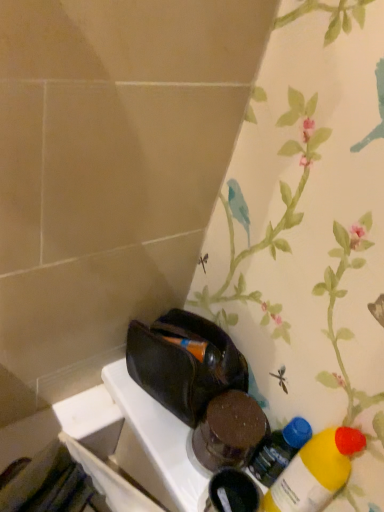
Question: Considering the positions of yellow matte bottle at lower right, the 1th bottle from the front, and translucent plastic bottle at lower right, marked as the 1th bottle in a back-to-front arrangement, in the image, is yellow matte bottle at lower right, the 1th bottle from the front, bigger or smaller than translucent plastic bottle at lower right, marked as the 1th bottle in a back-to-front arrangement,?

Choices:
 (A) small
 (B) big

Answer: (B)

Question: Looking at their shapes, would you say yellow matte bottle at lower right, the 1th bottle from the front, is wider or thinner than translucent plastic bottle at lower right, marked as the 1th bottle in a back-to-front arrangement?

Choices:
 (A) wide
 (B) thin

Answer: (A)

Question: Is point click(x=309, y=473) closer or farther from the camera than point click(x=291, y=435)?

Choices:
 (A) farther
 (B) closer

Answer: (B)

Question: From the image's perspective, is translucent plastic bottle at lower right, marked as the 1th bottle in a back-to-front arrangement, positioned above or below yellow matte bottle at lower right, which appears as the second bottle when viewed from the back?

Choices:
 (A) above
 (B) below

Answer: (A)

Question: Considering the positions of translucent plastic bottle at lower right, marked as the 1th bottle in a back-to-front arrangement, and yellow matte bottle at lower right, which appears as the second bottle when viewed from the back, in the image, is translucent plastic bottle at lower right, marked as the 1th bottle in a back-to-front arrangement, wider or thinner than yellow matte bottle at lower right, which appears as the second bottle when viewed from the back,?

Choices:
 (A) thin
 (B) wide

Answer: (A)

Question: Is point (296, 444) closer or farther from the camera than point (269, 494)?

Choices:
 (A) farther
 (B) closer

Answer: (B)

Question: From a real-world perspective, is translucent plastic bottle at lower right, marked as the 1th bottle in a back-to-front arrangement, physically located above or below yellow matte bottle at lower right, the 1th bottle from the front?

Choices:
 (A) above
 (B) below

Answer: (B)